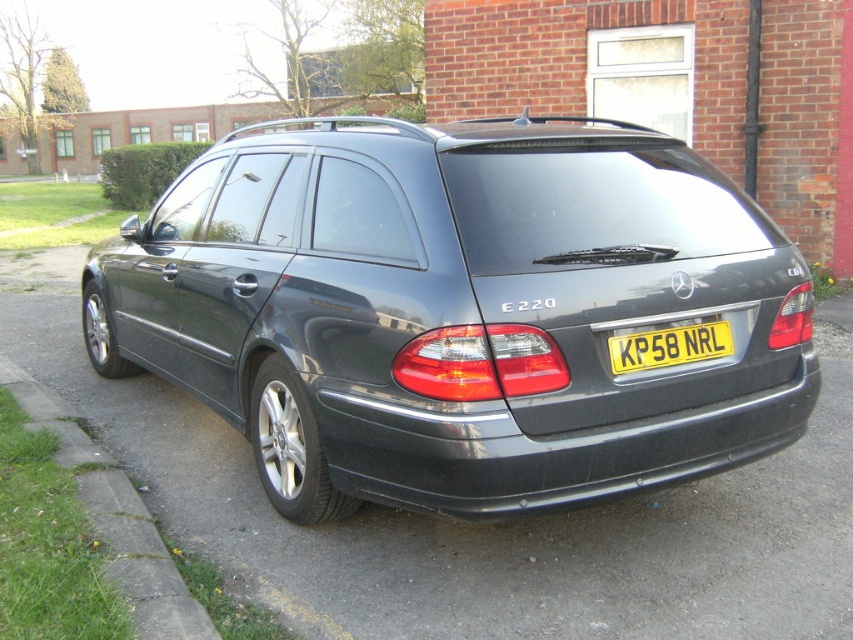
You are a photographer trying to capture the yellow metallic license plate at center clearly in your photo. However, the green grass at lower left is blocking part of the license plate. Can you adjust your camera angle to avoid the grass while still including both objects in the frame?

The green grass at lower left is larger than the yellow metallic license plate at center, so moving the camera angle slightly upward or to the right might help avoid the grass while keeping both objects in view.

You are a delivery person approaching the satin black station wagon at center and the yellow metallic license plate at center. Which object will you reach first?

You will reach the satin black station wagon at center first because it is closer to you than the yellow metallic license plate at center, which is further away.

Based on the photo, you are standing in front of a dark gray Mercedes Benz E220 Estate parked near a brick building. The car has a panoramic sunroof and the license plate KP58 NRL. There is a point marked at coordinates (459,310). What object is located at that point?

The point at coordinates (459,310) corresponds to the satin black station wagon at center.